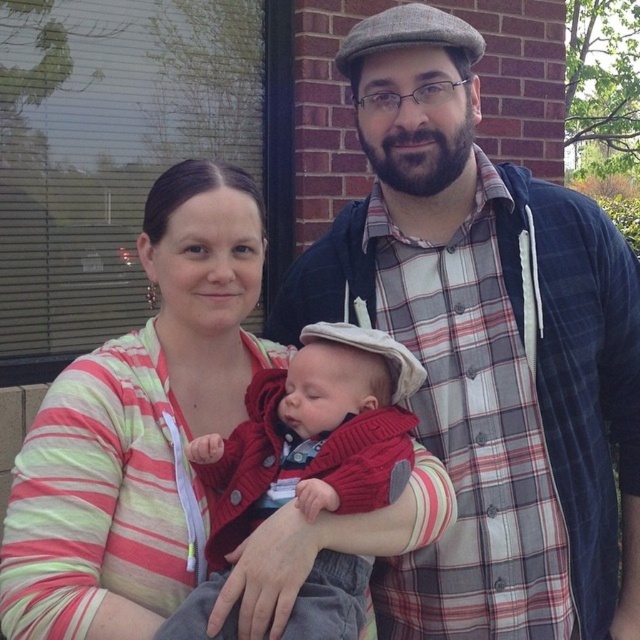
Based on the scene description, which clothing item, the plaid shirt at center or the striped fabric at center, is bigger in size?

The plaid shirt at center has a larger size compared to the striped fabric at center.

You are a photographer trying to capture the striped fabric at center in the image. The fabric is located at point (138,426). You need to focus your camera on this fabric. Which object in the scene is closest to this point to help you locate it?

The striped fabric at center is located at point (138,426), so the closest object to this point is the striped fabric at center itself.